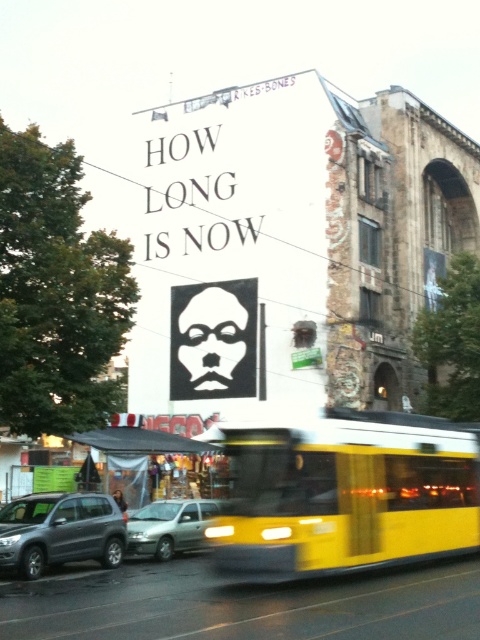
You are standing on the sidewalk in front of the billboard and see the yellow matte bus at center. If you want to take a photo of the billboard without the bus blocking it, where should you move relative to the bus?

Since the yellow matte bus at center is located at point (345,492), you should move to a position where you are not aligned with that coordinate to avoid the bus blocking the billboard.

You are a pedestrian standing on the sidewalk and see a matte gray suv at left and a silver metallic hatchback at center. Which vehicle is closer to you?

The matte gray suv at left is closer to you because it is in front of the silver metallic hatchback at center, meaning it is positioned nearer to your viewpoint.

You are a delivery person who needs to park your vehicle in a narrow alleyway that can only accommodate vehicles up to 2.5 meters in height. You observe the yellow matte bus at center and the matte gray suv at left. Which vehicle should you choose to park in the alleyway without exceeding the height limit?

The yellow matte bus at center is much taller than the matte gray suv at left, so you should choose the matte gray suv at left to park in the alleyway since it is shorter and meets the height requirement.